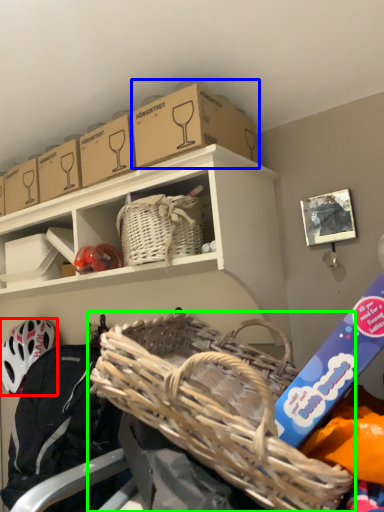
Question: Based on their relative distances, which object is nearer to helmet (highlighted by a red box)? Choose from storage box (highlighted by a blue box) and picnic basket (highlighted by a green box).

Choices:
 (A) storage box
 (B) picnic basket

Answer: (B)